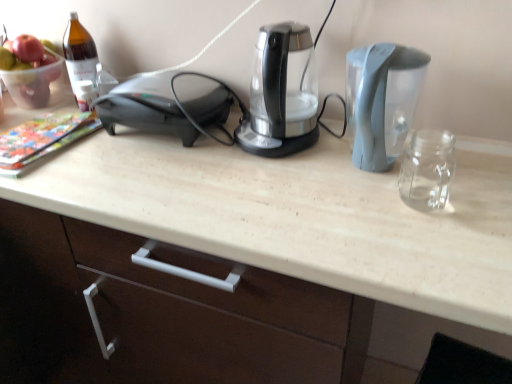
Question: Is the position of brown glass bottle at upper left less distant than that of black plastic toaster at left?

Choices:
 (A) yes
 (B) no

Answer: (B)

Question: From the image's perspective, is brown glass bottle at upper left beneath black plastic toaster at left?

Choices:
 (A) no
 (B) yes

Answer: (A)

Question: Is brown glass bottle at upper left positioned behind black plastic toaster at left?

Choices:
 (A) no
 (B) yes

Answer: (B)

Question: Is brown glass bottle at upper left not within black plastic toaster at left?

Choices:
 (A) no
 (B) yes

Answer: (B)

Question: Is brown glass bottle at upper left surrounding black plastic toaster at left?

Choices:
 (A) yes
 (B) no

Answer: (B)

Question: Are brown glass bottle at upper left and black plastic toaster at left beside each other?

Choices:
 (A) no
 (B) yes

Answer: (A)

Question: Can you confirm if translucent glass bowl at upper left is taller than gray plastic water at right, positioned as the 1th kitchen appliance in right-to-left order?

Choices:
 (A) yes
 (B) no

Answer: (B)

Question: Would you say gray plastic water at right, placed as the 2th kitchen appliance when sorted from left to right, is part of translucent glass bowl at upper left's contents?

Choices:
 (A) yes
 (B) no

Answer: (B)

Question: Is translucent glass bowl at upper left located outside gray plastic water at right, positioned as the 1th kitchen appliance in right-to-left order?

Choices:
 (A) no
 (B) yes

Answer: (B)

Question: Considering the relative sizes of translucent glass bowl at upper left and gray plastic water at right, placed as the 2th kitchen appliance when sorted from left to right, in the image provided, is translucent glass bowl at upper left bigger than gray plastic water at right, placed as the 2th kitchen appliance when sorted from left to right,?

Choices:
 (A) no
 (B) yes

Answer: (A)

Question: From the image's perspective, would you say translucent glass bowl at upper left is shown under gray plastic water at right, placed as the 2th kitchen appliance when sorted from left to right?

Choices:
 (A) no
 (B) yes

Answer: (A)

Question: Considering the relative sizes of translucent glass bowl at upper left and gray plastic water at right, placed as the 2th kitchen appliance when sorted from left to right, in the image provided, is translucent glass bowl at upper left shorter than gray plastic water at right, placed as the 2th kitchen appliance when sorted from left to right,?

Choices:
 (A) yes
 (B) no

Answer: (A)

Question: Would you say translucent glass bowl at upper left is part of black plastic toaster at left's contents?

Choices:
 (A) no
 (B) yes

Answer: (A)